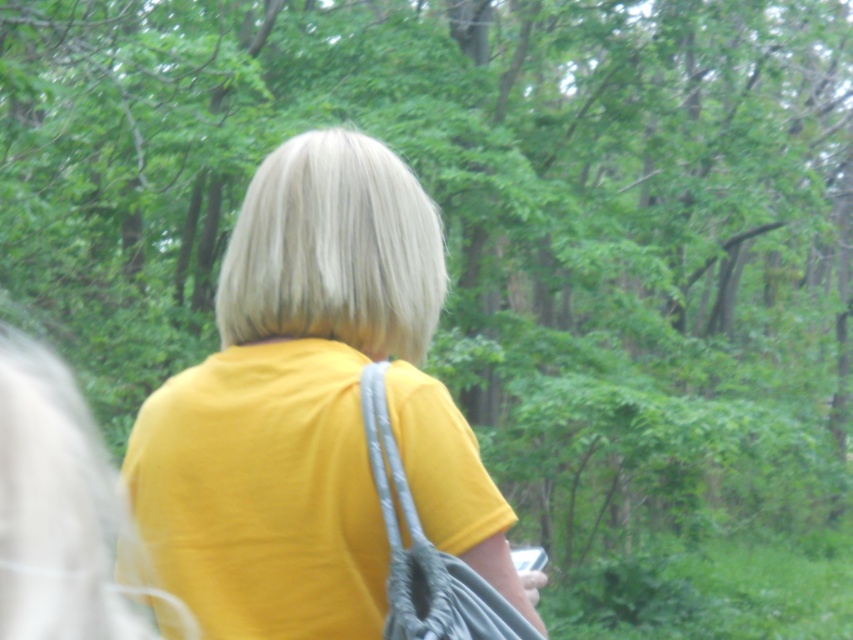
Question: Which object is closer to the camera taking this photo?

Choices:
 (A) gray fabric strap at center
 (B) matte yellow shirt at center

Answer: (A)

Question: Is matte yellow shirt at center bigger than gray fabric strap at center?

Choices:
 (A) yes
 (B) no

Answer: (A)

Question: Among these points, which one is nearest to the camera?

Choices:
 (A) (523, 634)
 (B) (234, 369)

Answer: (A)

Question: Which point appears closest to the camera in this image?

Choices:
 (A) (361, 410)
 (B) (248, 374)

Answer: (A)

Question: Does matte yellow shirt at center come in front of gray fabric strap at center?

Choices:
 (A) yes
 (B) no

Answer: (B)

Question: Is matte yellow shirt at center to the left of gray fabric strap at center from the viewer's perspective?

Choices:
 (A) yes
 (B) no

Answer: (A)